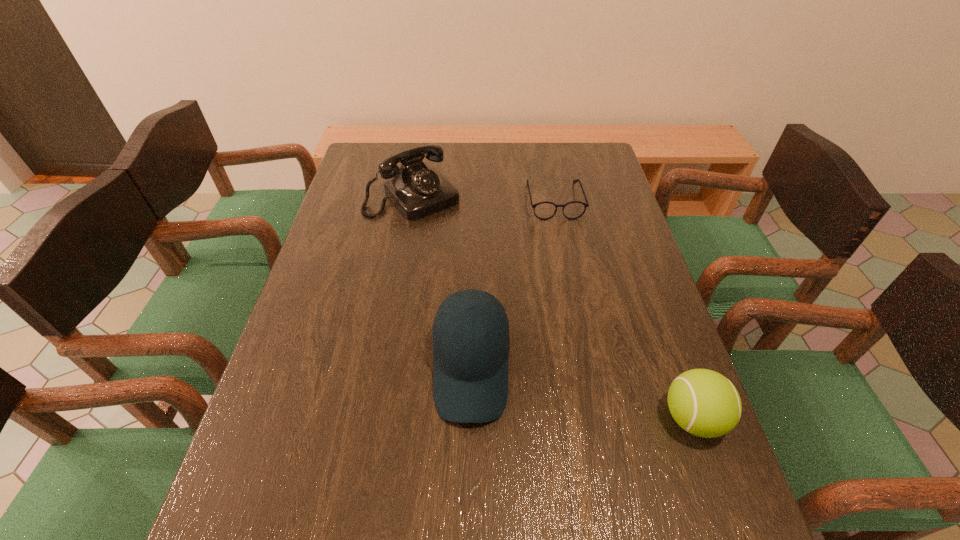
Find the location of a particular element. vacant region that satisfies the following two spatial constraints: 1. on the front-facing side of the baseball cap; 2. on the left side of the tennis ball is located at coordinates (470, 418).

You are a GUI agent. You are given a task and a screenshot of the screen. Output one action in this format:
    pyautogui.click(x=<x>, y=<y>)
    Task: Click on the free space in the image that satisfies the following two spatial constraints: 1. on the front-facing side of the tennis ball; 2. on the left side of the baseball cap
    The image size is (960, 540).
    Given the screenshot: What is the action you would take?
    pyautogui.click(x=470, y=418)

This screenshot has width=960, height=540. I want to click on blank space that satisfies the following two spatial constraints: 1. on the front side of the telephone; 2. on the right side of the tennis ball, so click(x=373, y=418).

Locate an element on the screen. This screenshot has height=540, width=960. free space in the image that satisfies the following two spatial constraints: 1. on the front-facing side of the rightmost object; 2. on the right side of the baseball cap is located at coordinates (470, 418).